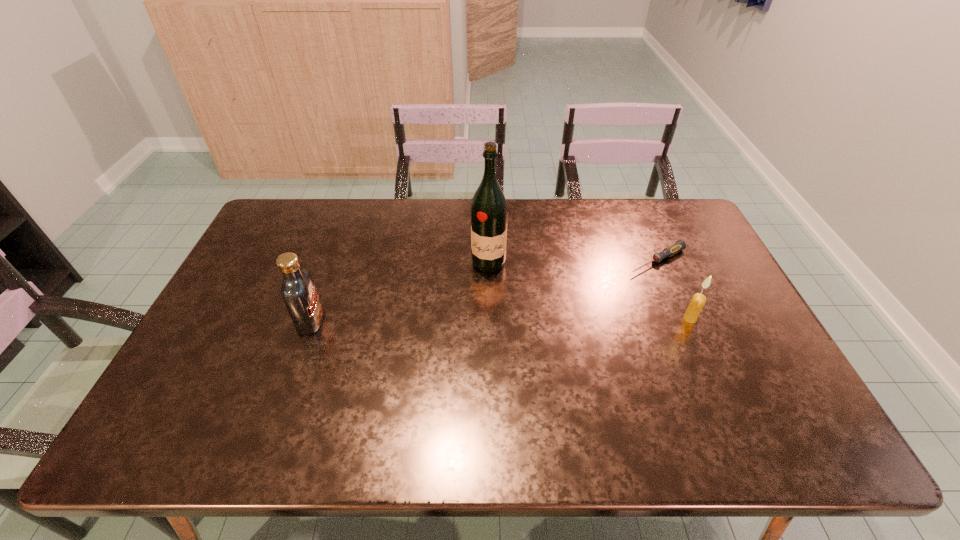
The width and height of the screenshot is (960, 540). Find the location of `vacant space located 0.240m insert the shortest object into a screw head`. vacant space located 0.240m insert the shortest object into a screw head is located at coordinates click(577, 300).

Locate an element on the screen. This screenshot has width=960, height=540. free space located on the front-facing side of the liquor is located at coordinates (466, 348).

I want to click on vacant region located 0.050m on the front-facing side of the liquor, so click(x=483, y=285).

You are a GUI agent. You are given a task and a screenshot of the screen. Output one action in this format:
    pyautogui.click(x=<x>, y=<y>)
    Task: Click on the blank space located on the front-facing side of the liquor
    This screenshot has width=960, height=540.
    Given the screenshot: What is the action you would take?
    pyautogui.click(x=458, y=380)

The image size is (960, 540). I want to click on candle located in the right edge section of the desktop, so click(697, 302).

The height and width of the screenshot is (540, 960). Identify the location of screwdriver that is at the right edge. (676, 247).

The height and width of the screenshot is (540, 960). In the image, there is a desktop. Identify the location of vacant space at the far edge. (451, 204).

Identify the location of free space at the near edge of the desktop. (611, 379).

Identify the location of blank area at the left edge. (x=229, y=345).

The height and width of the screenshot is (540, 960). I want to click on vacant area at the right edge of the desktop, so click(x=716, y=271).